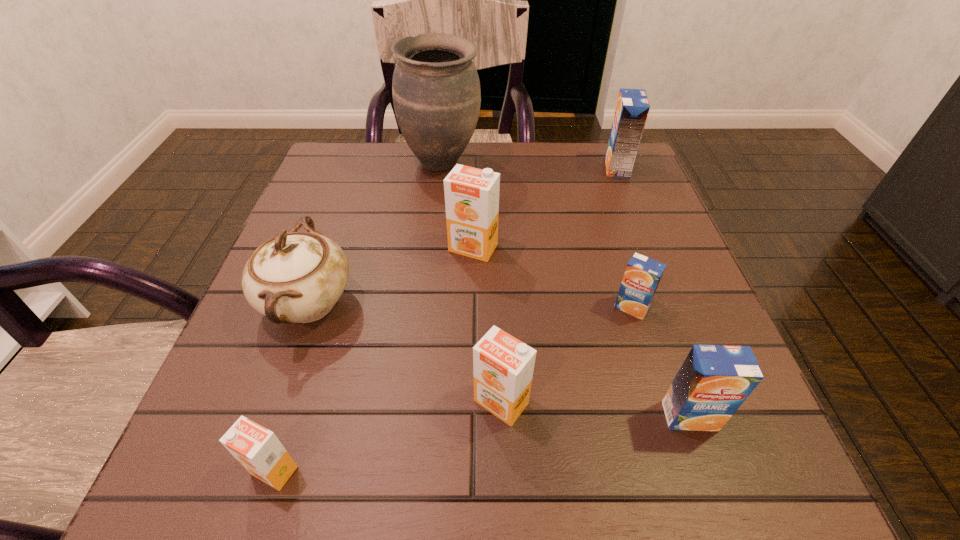
Locate an element on the screen. This screenshot has width=960, height=540. the nearest orange juice is located at coordinates (257, 449).

This screenshot has height=540, width=960. I want to click on the nearest orange orange juice, so click(x=257, y=449).

You are a GUI agent. You are given a task and a screenshot of the screen. Output one action in this format:
    pyautogui.click(x=<x>, y=<y>)
    Task: Click on the vacant space located on the left of the urn
    The width and height of the screenshot is (960, 540).
    Given the screenshot: What is the action you would take?
    pyautogui.click(x=371, y=163)

This screenshot has width=960, height=540. In order to click on free location located 0.280m on the left of the biggest blue orange_juice in this screenshot , I will do `click(492, 167)`.

Where is `blank space located 0.050m on the back of the biggest orange orange juice`? The width and height of the screenshot is (960, 540). blank space located 0.050m on the back of the biggest orange orange juice is located at coordinates (473, 219).

At what (x,y) coordinates should I click in order to perform the action: click on free space located 0.150m on the front of the white chinaware. Please return your answer as a coordinate pair (x, y). This screenshot has height=540, width=960. Looking at the image, I should click on coord(258,447).

Where is `vacant space located on the left of the nearest blue orange_juice`? vacant space located on the left of the nearest blue orange_juice is located at coordinates (596, 416).

Locate an element on the screen. This screenshot has width=960, height=540. vacant space situated 0.230m on the left of the second smallest orange orange juice is located at coordinates (321, 402).

Locate an element on the screen. The height and width of the screenshot is (540, 960). free region located 0.400m on the back of the second farthest blue orange_juice is located at coordinates (589, 174).

Image resolution: width=960 pixels, height=540 pixels. Identify the location of free spot located 0.150m on the back of the smallest orange orange juice. (309, 359).